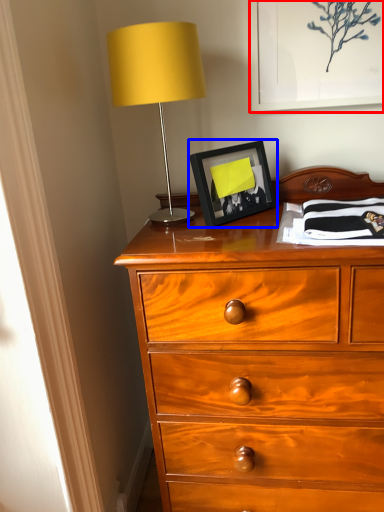
Question: Among these objects, which one is nearest to the camera, picture frame (highlighted by a red box) or picture frame (highlighted by a blue box)?

Choices:
 (A) picture frame
 (B) picture frame

Answer: (B)